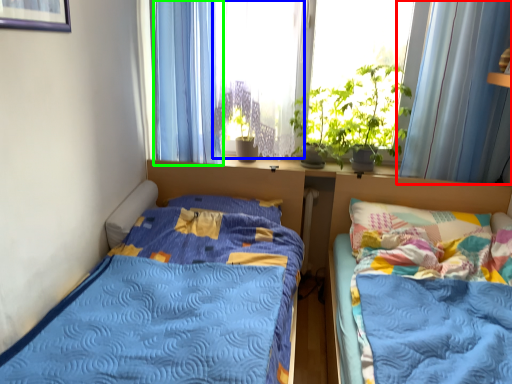
Question: Based on their relative distances, which object is farther from curtain (highlighted by a red box)? Choose from window screen (highlighted by a blue box) and curtain (highlighted by a green box).

Choices:
 (A) window screen
 (B) curtain

Answer: (B)